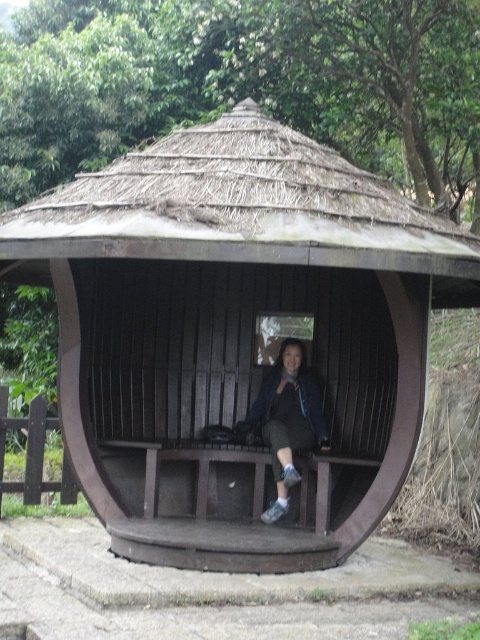
You are standing at point (236, 333) in the image. What is located exactly at this point?

The brown wooden gazebo at center is located exactly at point (236, 333).

You are a photographer planning to take a full body portrait of the person wearing the matte blue jacket at center. The brown wooden gazebo at center is in the background. Considering the height difference between the two, will the gazebo obscure the person from head to toe in the photo?

The brown wooden gazebo at center is much taller than the matte blue jacket at center, so the gazebo will likely obscure the top part of the person but not the lower body in the photo.

You are standing outside the brown wooden gazebo at center and want to place a small potted plant on the ground near the matte blue jacket at center. Based on the scene, can you determine if the gazebo will block the view of the jacket from your current position?

The brown wooden gazebo at center is above matte blue jacket at center, so the gazebo will block the view of the jacket from your current position outside the gazebo at center.